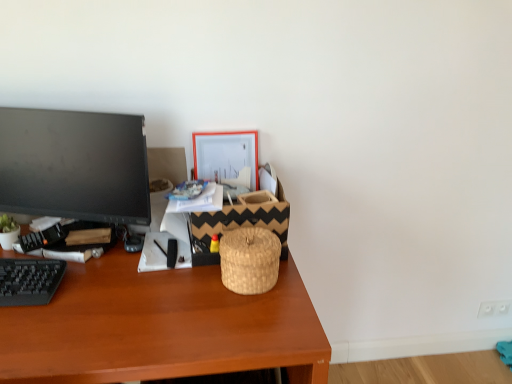
Locate an element on the screen. This screenshot has width=512, height=384. free spot in front of woven straw basket at center, marked as the 1th basket in a back-to-front arrangement is located at coordinates (195, 308).